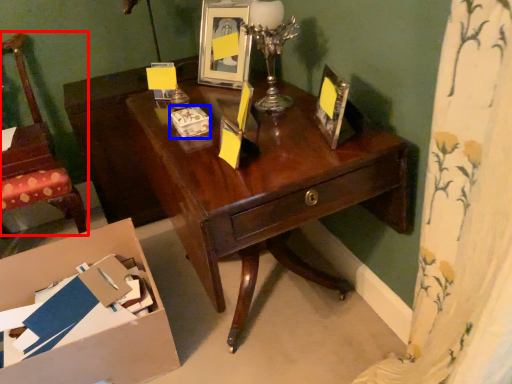
Question: Which point is further to the camera, chair (highlighted by a red box) or box (highlighted by a blue box)?

Choices:
 (A) chair
 (B) box

Answer: (A)